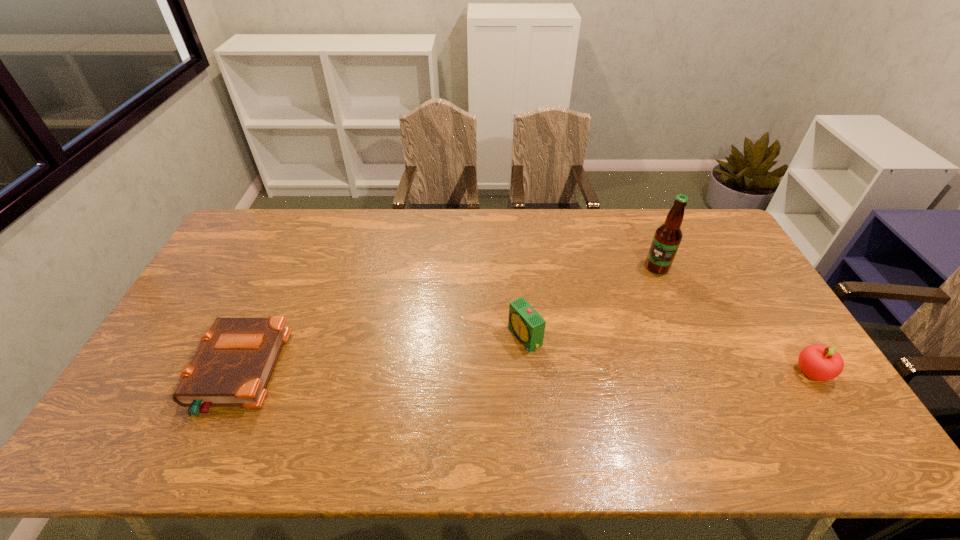
At what (x,y) coordinates should I click in order to perform the action: click on object that is at the near right corner. Please return your answer as a coordinate pair (x, y). Looking at the image, I should click on (819, 362).

The height and width of the screenshot is (540, 960). In the image, there is a desktop. What are the coordinates of `free space at the far edge` in the screenshot? It's located at (588, 248).

Identify the location of free location at the near edge. The height and width of the screenshot is (540, 960). (649, 386).

Locate an element on the screen. The width and height of the screenshot is (960, 540). vacant space at the left edge is located at coordinates (226, 257).

Find the location of a particular element. Image resolution: width=960 pixels, height=540 pixels. blank area at the right edge is located at coordinates (718, 253).

In the image, there is a desktop. Where is `vacant region at the far left corner`? This screenshot has height=540, width=960. vacant region at the far left corner is located at coordinates (278, 224).

Locate an element on the screen. The image size is (960, 540). vacant space at the near left corner is located at coordinates (129, 400).

You are a GUI agent. You are given a task and a screenshot of the screen. Output one action in this format:
    pyautogui.click(x=<x>, y=<y>)
    Task: Click on the free space that is in between the leftmost object and the second object from right to left
    
    Given the screenshot: What is the action you would take?
    pyautogui.click(x=447, y=320)

Find the location of a particular element. The image size is (960, 540). free spot between the second object from left to right and the farthest object is located at coordinates (591, 302).

The height and width of the screenshot is (540, 960). Identify the location of free space between the apple and the alarm clock. (668, 355).